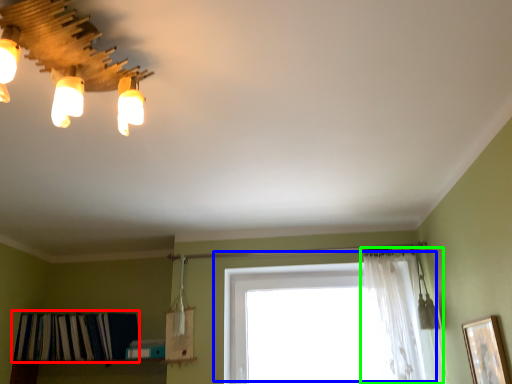
Question: Based on their relative distances, which object is nearer to shelf (highlighted by a red box)? Choose from window (highlighted by a blue box) and curtain (highlighted by a green box).

Choices:
 (A) window
 (B) curtain

Answer: (A)